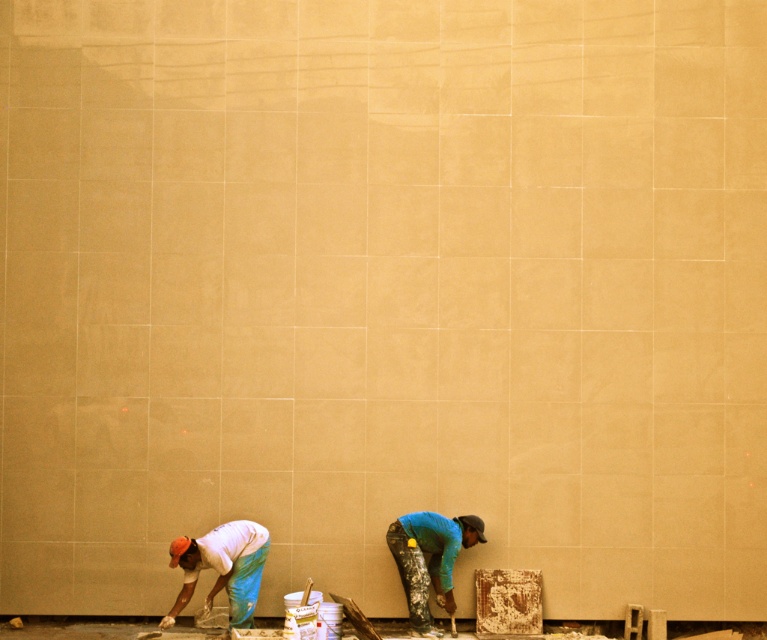
Question: Which object is closer to the camera taking this photo?

Choices:
 (A) blue fabric worker at lower center
 (B) white matte shirt at lower left

Answer: (B)

Question: Which point appears closest to the camera in this image?

Choices:
 (A) (453, 516)
 (B) (257, 586)

Answer: (B)

Question: Does white matte shirt at lower left appear over blue fabric worker at lower center?

Choices:
 (A) no
 (B) yes

Answer: (A)

Question: In this image, where is white matte shirt at lower left located relative to blue fabric worker at lower center?

Choices:
 (A) below
 (B) above

Answer: (A)

Question: Does white matte shirt at lower left have a smaller size compared to blue fabric worker at lower center?

Choices:
 (A) no
 (B) yes

Answer: (A)